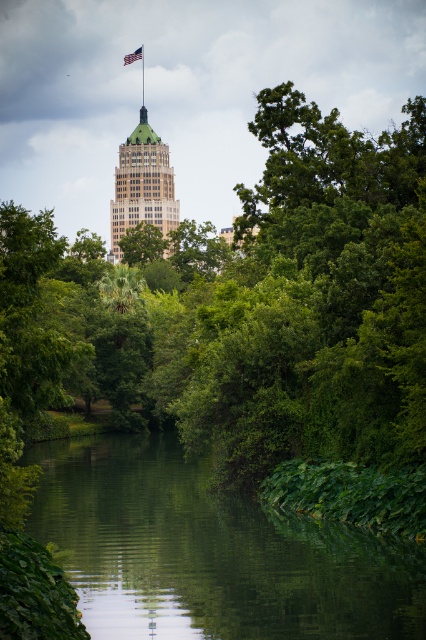
You are a city planner analyzing this urban landscape. You need to determine if the green leafy river at center can accommodate a new boat that is 2 meters wide. The metallic pole at upper center is 1.5 meters wide. Can the river accommodate the boat?

The green leafy river at center is wider than the metallic pole at upper center, which is 1.5 meters wide. Since the river is wider, it can accommodate the boat that is 2 meters wide.

You are standing in the urban park and want to take a photo of the green leafy tree at center and the metallic pole at upper center. Which object should you focus on first to ensure both are in the frame?

You should focus on the green leafy tree at center first since it is closer to you than the metallic pole at upper center, ensuring both are in the frame.

You are standing in the urban landscape scene and want to reach the metallic pole at upper center. Given that the pole is 1366.04 feet away, is it possible to walk directly to it without any obstacles?

The metallic pole at upper center is 1366.04 feet away from the viewer, so it is possible to walk directly to it as there are no obstacles mentioned in the scene description.